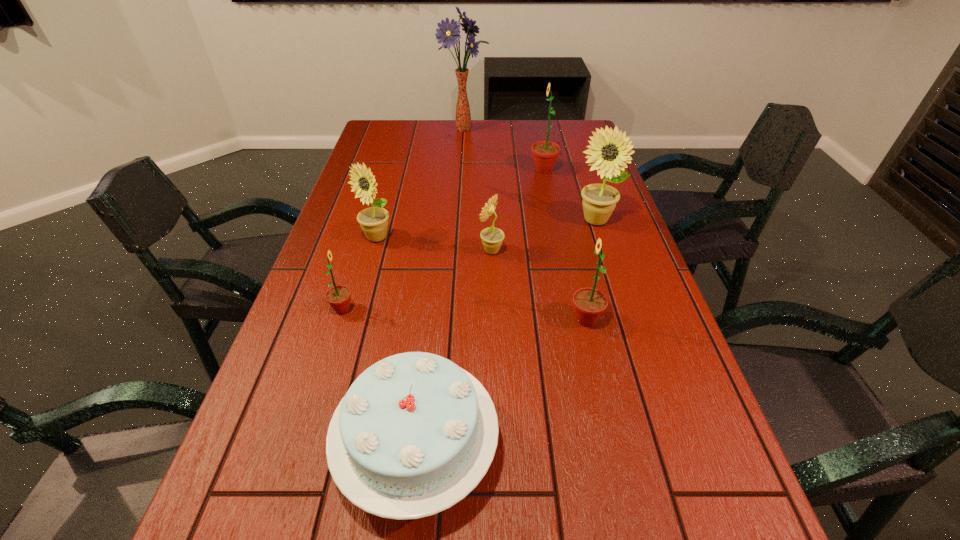
I want to click on blank space at the far left corner of the desktop, so click(x=396, y=126).

Image resolution: width=960 pixels, height=540 pixels. I want to click on free space at the far right corner of the desktop, so click(x=586, y=127).

Locate an element on the screen. The height and width of the screenshot is (540, 960). empty space that is in between the smallest yellow sunflower and the flower arrangement is located at coordinates (478, 190).

You are a GUI agent. You are given a task and a screenshot of the screen. Output one action in this format:
    pyautogui.click(x=<x>, y=<y>)
    Task: Click on the unoccupied area between the purple flower arrangement and the second smallest green sunflower
    The image size is (960, 540).
    Given the screenshot: What is the action you would take?
    pyautogui.click(x=525, y=224)

I want to click on vacant area between the rightmost yellow sunflower and the farthest sunflower, so click(569, 195).

Locate an element on the screen. This screenshot has height=540, width=960. free space that is in between the flower arrangement and the fourth sunflower from right to left is located at coordinates (478, 190).

The height and width of the screenshot is (540, 960). I want to click on empty location between the leftmost yellow sunflower and the second smallest green sunflower, so click(x=481, y=279).

Identify the location of empty space between the purple flower arrangement and the biggest yellow sunflower. The height and width of the screenshot is (540, 960). (x=530, y=174).

Where is `vacant space that's between the second yellow sunflower from left to right and the smallest green sunflower`? vacant space that's between the second yellow sunflower from left to right and the smallest green sunflower is located at coordinates (417, 280).

Point out which object is positioned as the seventh nearest to the second yellow sunflower from right to left. Please provide its 2D coordinates. Your answer should be formatted as a tuple, i.e. [(x, y)], where the tuple contains the x and y coordinates of a point satisfying the conditions above.

[(448, 33)]